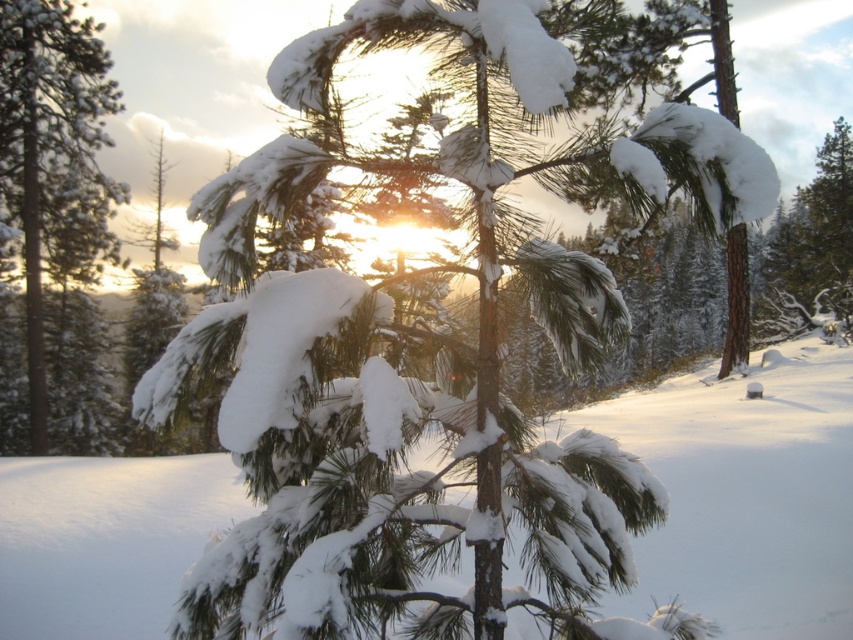
Question: Which object is closer to the camera taking this photo?

Choices:
 (A) white fluffy snow at center
 (B) snow-covered pine at left

Answer: (A)

Question: Does white fluffy snow at center have a smaller size compared to snow-covered pine at left?

Choices:
 (A) no
 (B) yes

Answer: (B)

Question: Observing the image, what is the correct spatial positioning of white fluffy snow at center in reference to snow-covered pine at left?

Choices:
 (A) right
 (B) left

Answer: (A)

Question: Is white fluffy snow at center below snow-covered pine at left?

Choices:
 (A) no
 (B) yes

Answer: (B)

Question: Which object is closer to the camera taking this photo?

Choices:
 (A) white fluffy snow at center
 (B) snow-covered pine at left

Answer: (A)